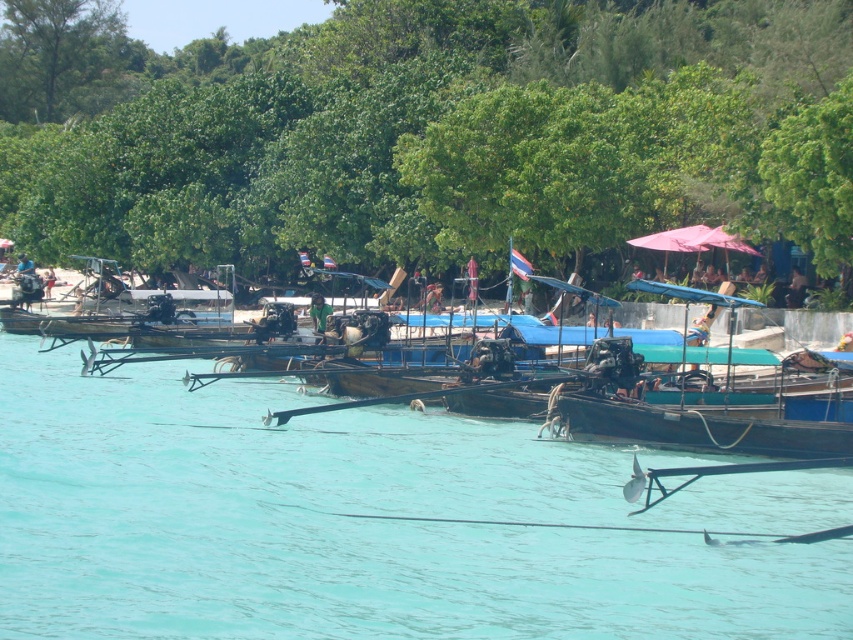
You are standing at the origin point of the coordinate system in the image. You want to reach the dark brown wooden boat at center. Which direction should you move to reach it?

The dark brown wooden boat at center is located at coordinate point (553, 416). Since you are at the origin, you should move towards the positive x and y directions to reach it.

From the picture: You are a photographer planning to take a picture of the waterfront scene. You want to include both the green leafy trees at center and the green leafy tree at upper right in your shot. Which tree will appear larger in the final photograph?

The green leafy trees at center will appear larger in the final photograph because it is bigger than the green leafy tree at upper right.